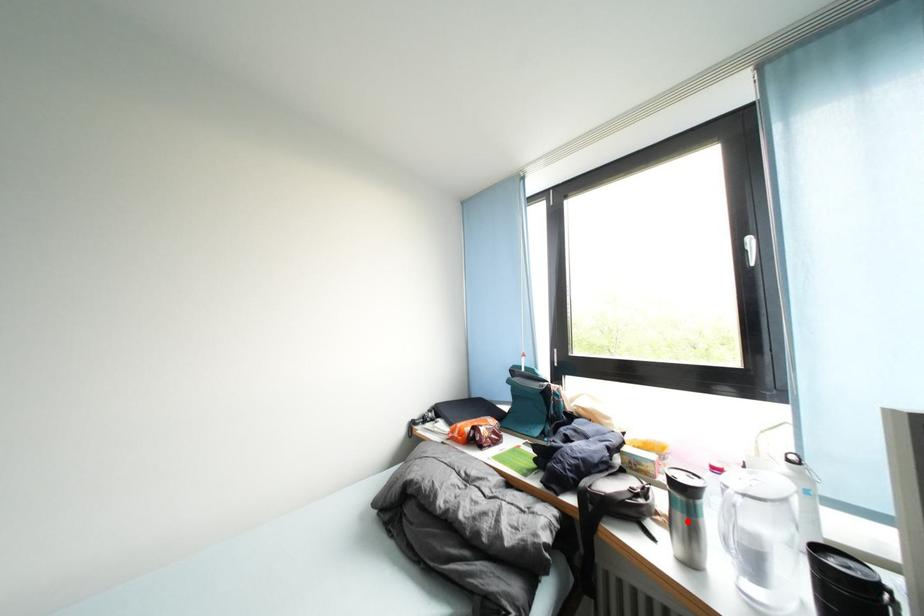
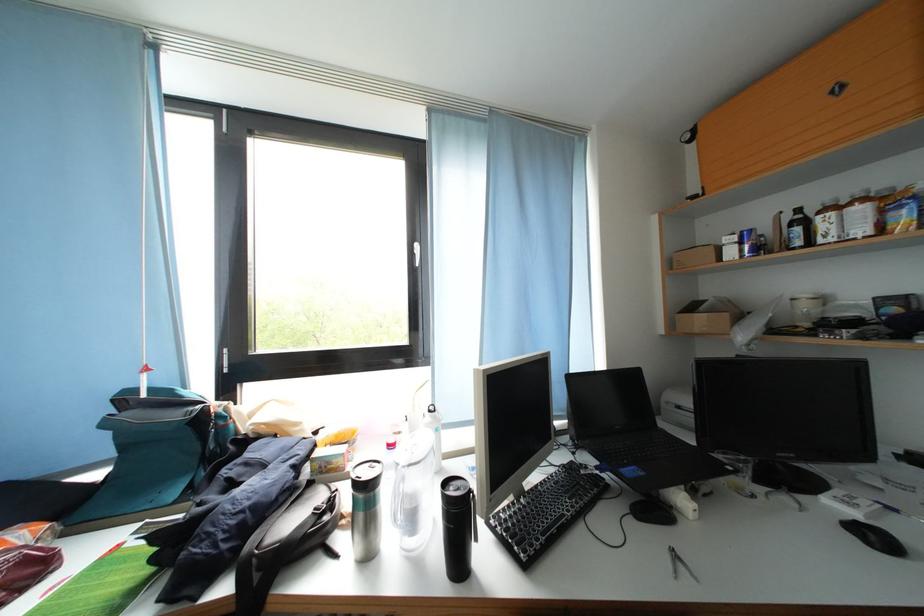
In the second image, find the point that corresponds to the highlighted location in the first image.

(369, 521)